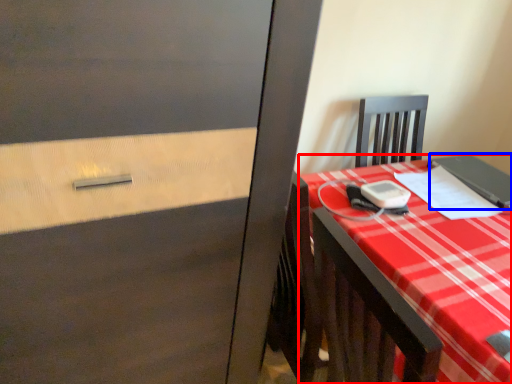
Question: Which object is further to the camera taking this photo, desk (highlighted by a red box) or notebook (highlighted by a blue box)?

Choices:
 (A) desk
 (B) notebook

Answer: (B)